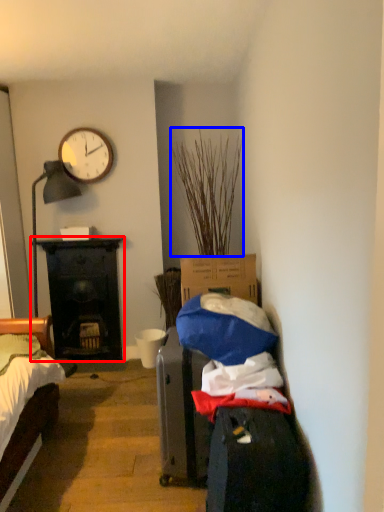
Question: Which point is closer to the camera, desk (highlighted by a red box) or plant (highlighted by a blue box)?

Choices:
 (A) desk
 (B) plant

Answer: (B)